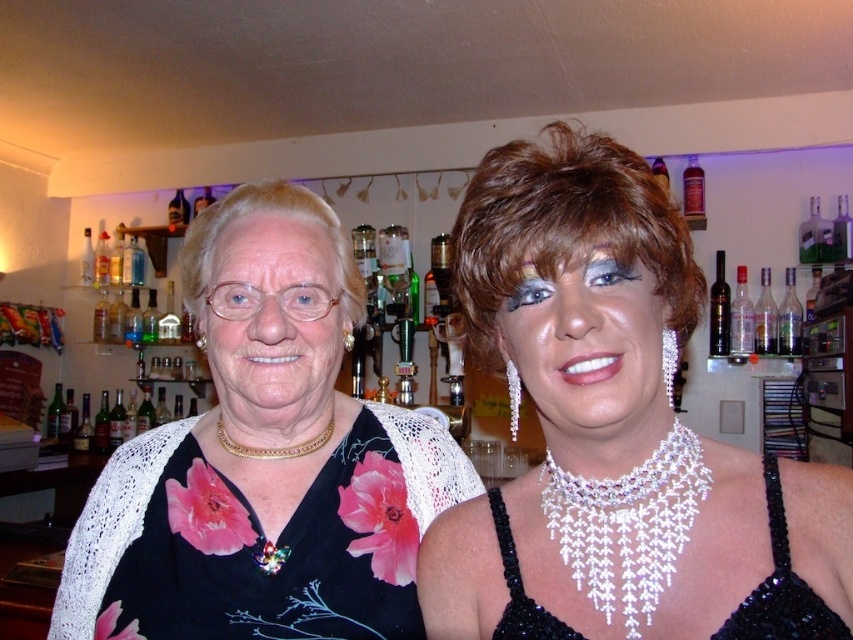
You are a photographer standing in front of the scene described. You want to take a photo of the two people but need to ensure that the focus is sharp at the point marked as point (x=498, y=547). What is the minimum focusing distance you should set your camera to achieve this?

The minimum focusing distance you should set is 52.52 centimeters to ensure the focus is sharp at point (x=498, y=547).

You are a photographer trying to capture the sparkly silver necklace at center and the matte black dress at center in a single frame. Based on their positions, can you determine which object is closer to the camera?

The sparkly silver necklace at center is located above the matte black dress at center, which means it is closer to the camera.